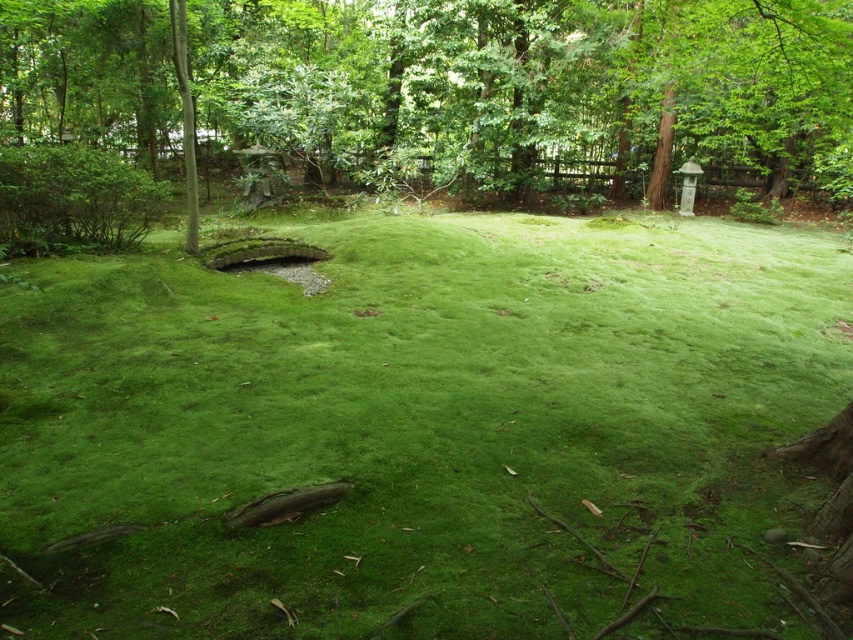
Question: Is green mossy ground at center positioned before green leafy tree at center?

Choices:
 (A) no
 (B) yes

Answer: (A)

Question: Which of the following is the closest to the observer?

Choices:
 (A) green leafy tree at center
 (B) green mossy ground at center

Answer: (A)

Question: In this image, where is green mossy ground at center located relative to green leafy tree at center?

Choices:
 (A) above
 (B) below

Answer: (B)

Question: Is green mossy ground at center positioned before green leafy tree at center?

Choices:
 (A) no
 (B) yes

Answer: (A)

Question: Which of the following is the farthest from the observer?

Choices:
 (A) (473, 512)
 (B) (750, 182)

Answer: (B)